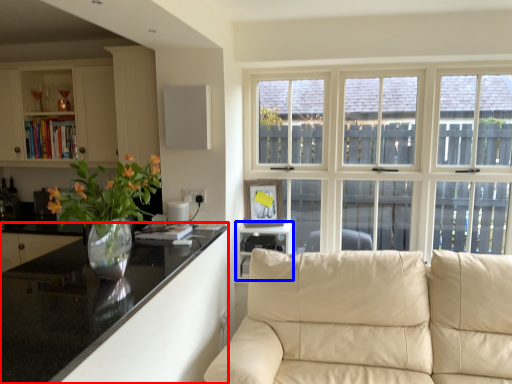
Question: Which of the following is the farthest to the observer, countertop (highlighted by a red box) or shelf (highlighted by a blue box)?

Choices:
 (A) countertop
 (B) shelf

Answer: (B)